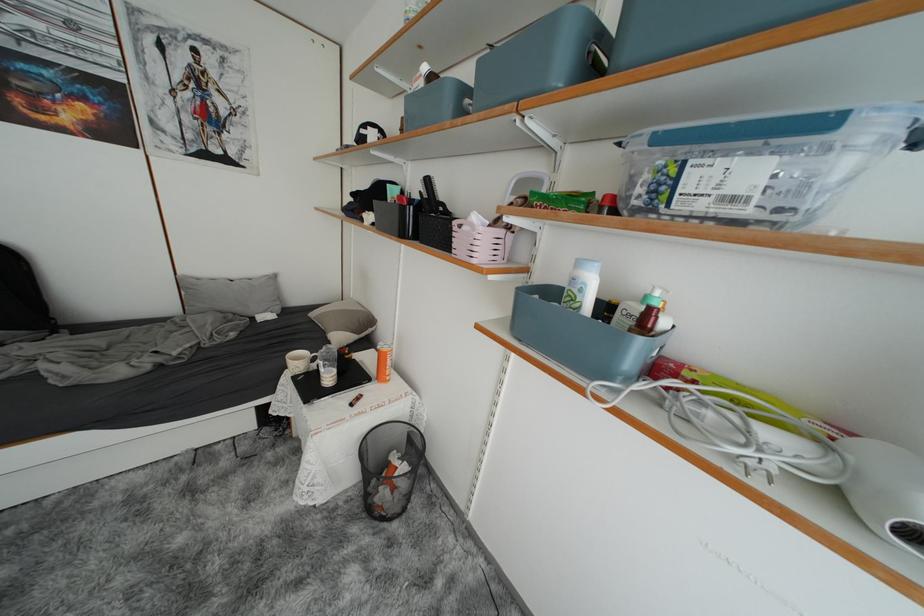
Where would you press the lotion bottle pump? Please return your answer as a coordinate pair (x, y).

(587, 289)